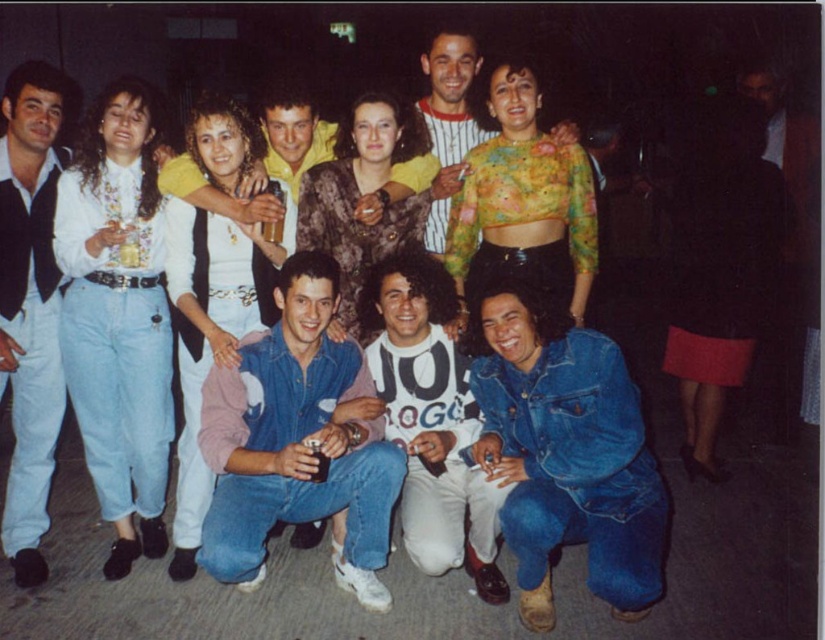
Who is positioned more to the right, denim jacket at center or fur coat at center?

fur coat at center

Which of these two, denim jacket at center or fur coat at center, stands shorter?

fur coat at center

Find the location of `denim jacket at center`. denim jacket at center is located at coordinates (297, 444).

Can you confirm if floral sheer top at center is positioned above fur coat at center?

No, floral sheer top at center is not above fur coat at center.

Is floral sheer top at center smaller than fur coat at center?

Actually, floral sheer top at center might be larger than fur coat at center.

Measure the distance between floral sheer top at center and camera.

They are 3.01 meters apart.

Locate an element on the screen. The image size is (825, 640). floral sheer top at center is located at coordinates (522, 205).

Is matte black skirt at right above striped fabric shirt at upper center?

No.

Who is higher up, matte black skirt at right or striped fabric shirt at upper center?

striped fabric shirt at upper center

Is point (691, 209) farther from viewer compared to point (472, 100)?

Yes, it is behind point (472, 100).

The width and height of the screenshot is (825, 640). What are the coordinates of `matte black skirt at right` in the screenshot? It's located at (720, 262).